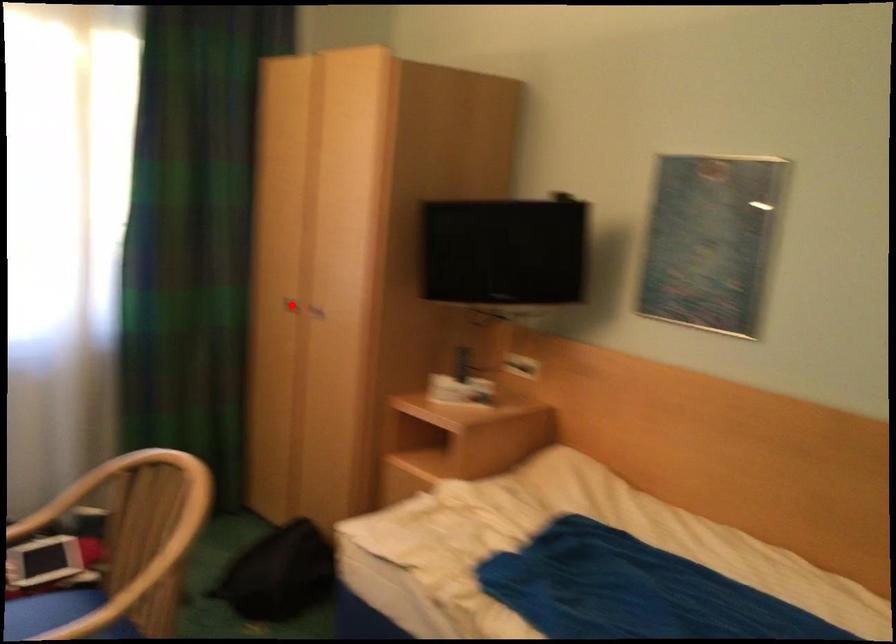
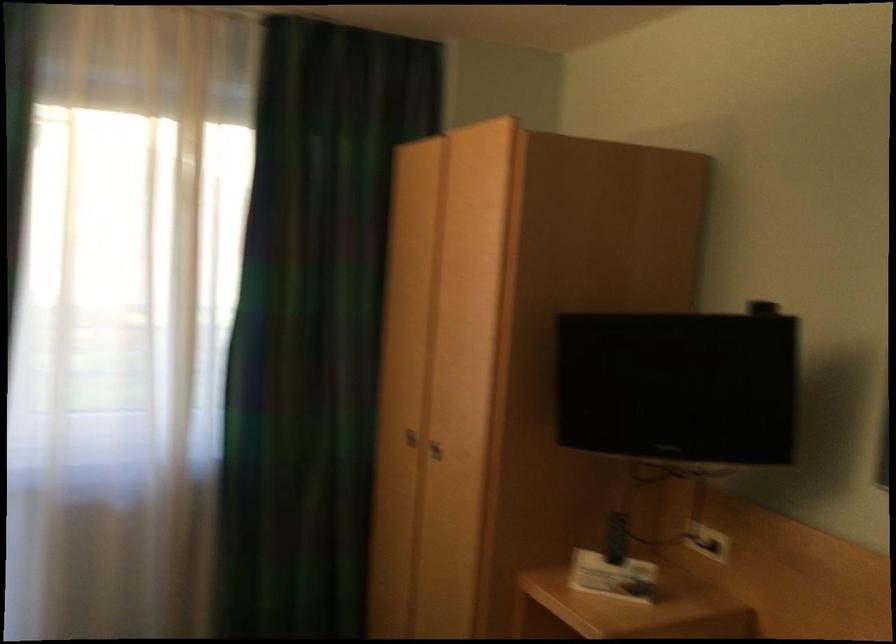
Question: I am providing you with two images of the same scene from different viewpoints. A red point is shown in image1. For the corresponding object point in image2, is it positioned nearer or farther from the camera?

Choices:
 (A) Nearer
 (B) Farther

Answer: (A)